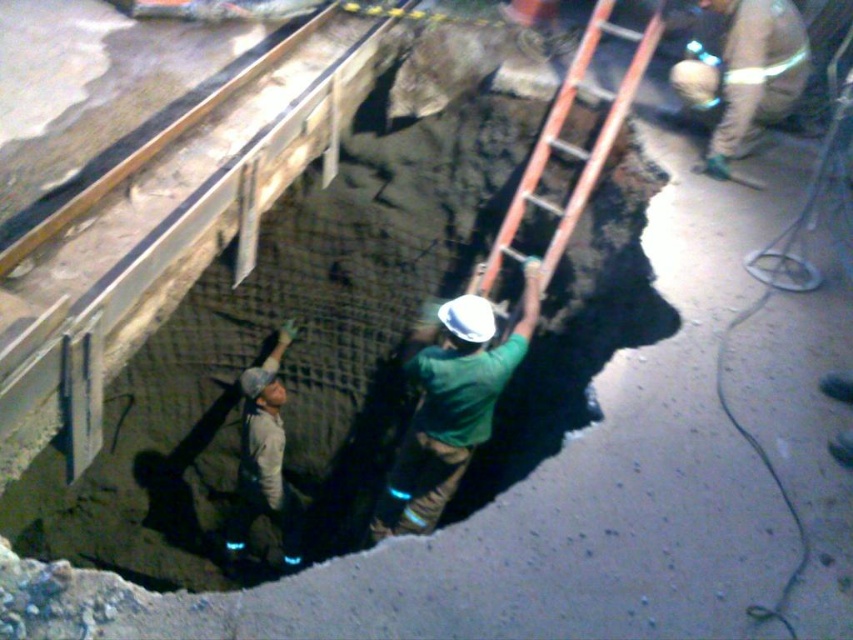
Is green matte helmet at center closer to the viewer compared to orange wooden ladder at center?

Yes, it is in front of orange wooden ladder at center.

Find the location of a particular element. The image size is (853, 640). green matte helmet at center is located at coordinates (451, 406).

Does point (405, 365) come behind point (761, 10)?

That is False.

Between green matte helmet at center and light brown leather pants at upper right, which one is positioned higher?

Positioned higher is light brown leather pants at upper right.

Who is more distant from viewer, (396, 492) or (798, 29)?

Point (798, 29)

The height and width of the screenshot is (640, 853). I want to click on green matte helmet at center, so click(451, 406).

Which is behind, point (779, 68) or point (250, 458)?

Point (250, 458)

How distant is light brown leather pants at upper right from tan fabric construction worker at lower left?

The distance of light brown leather pants at upper right from tan fabric construction worker at lower left is 10.58 feet.

Who is more distant from viewer, (711, 45) or (270, 460)?

The point (711, 45) is more distant.

This screenshot has width=853, height=640. Find the location of `light brown leather pants at upper right`. light brown leather pants at upper right is located at coordinates (740, 72).